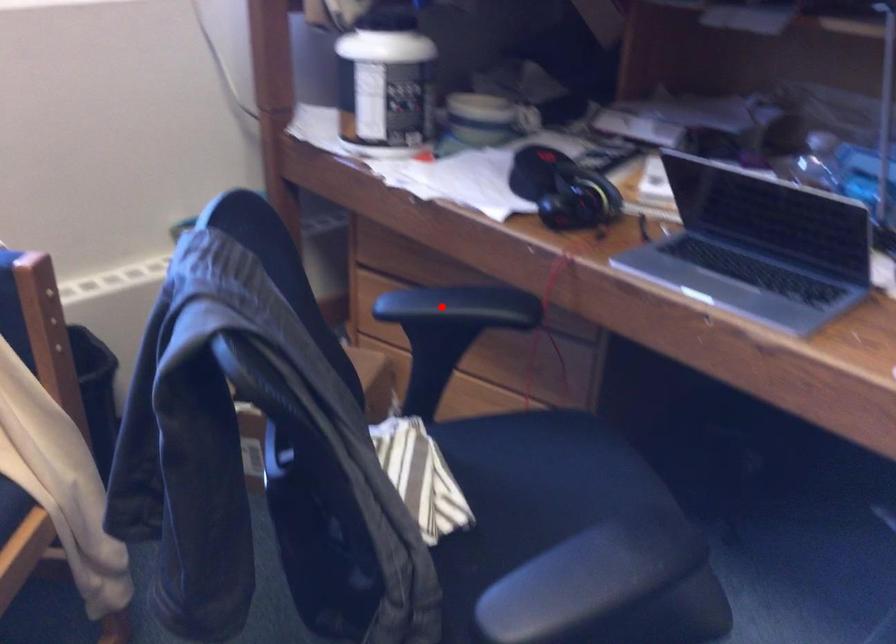
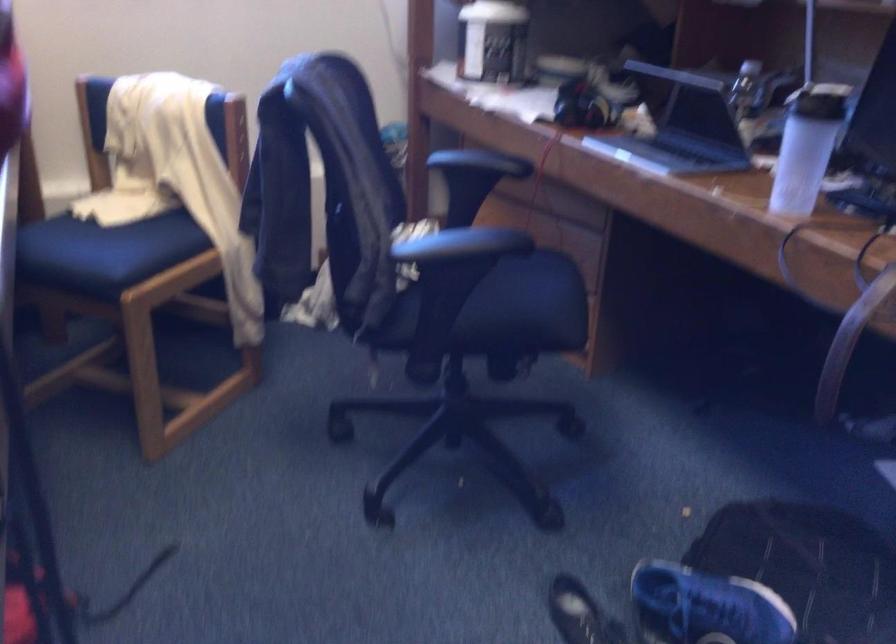
Question: I am providing you with two images of the same scene from different viewpoints. A red point is shown in image1. For the corresponding object point in image2, is it positioned nearer or farther from the camera?

Choices:
 (A) Nearer
 (B) Farther

Answer: (B)